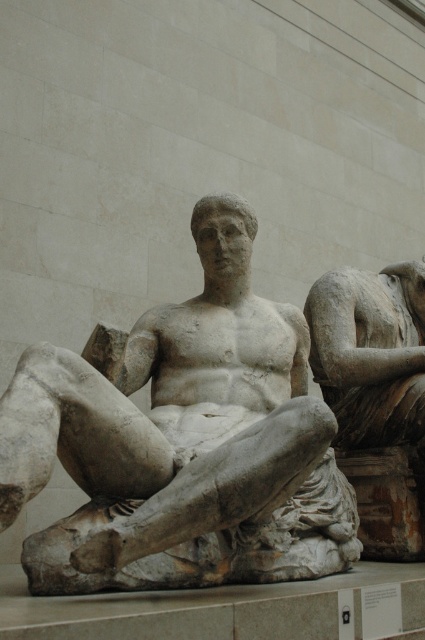
Question: Which of the following is the farthest from the observer?

Choices:
 (A) white marble statue at center
 (B) matte stone reclining figure at center

Answer: (B)

Question: Does white marble statue at center come in front of matte stone reclining figure at center?

Choices:
 (A) yes
 (B) no

Answer: (A)

Question: Which point appears closest to the camera in this image?

Choices:
 (A) [x=374, y=401]
 (B) [x=183, y=388]

Answer: (B)

Question: Does white marble statue at center have a lesser width compared to matte stone reclining figure at center?

Choices:
 (A) no
 (B) yes

Answer: (A)

Question: Does white marble statue at center lie in front of matte stone reclining figure at center?

Choices:
 (A) yes
 (B) no

Answer: (A)